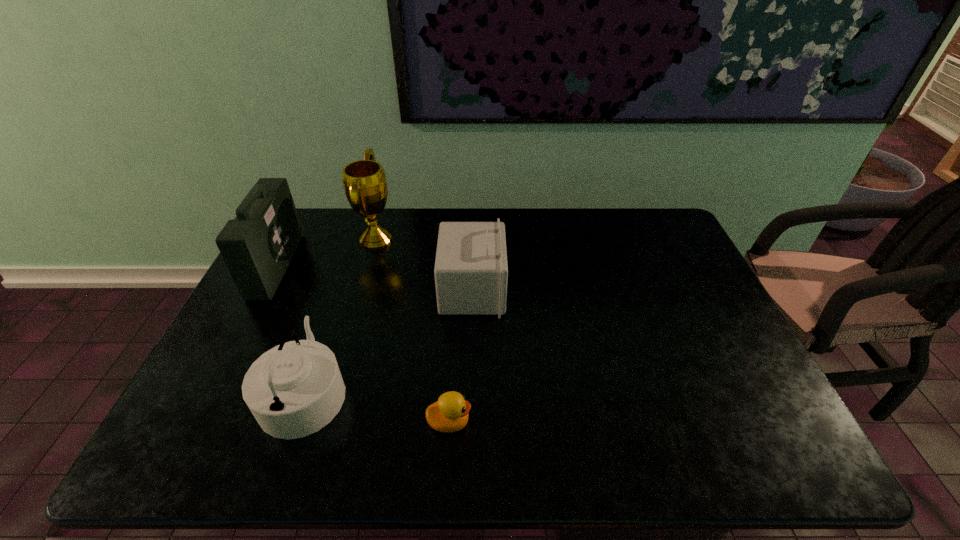
This screenshot has height=540, width=960. I want to click on award, so click(364, 181).

Locate an element on the screen. The width and height of the screenshot is (960, 540). the left first-aid kit is located at coordinates (257, 246).

At what (x,y) coordinates should I click in order to perform the action: click on the taller first-aid kit. Please return your answer as a coordinate pair (x, y). The height and width of the screenshot is (540, 960). Looking at the image, I should click on (257, 246).

You are a GUI agent. You are given a task and a screenshot of the screen. Output one action in this format:
    pyautogui.click(x=<x>, y=<y>)
    Task: Click on the right first-aid kit
    The height and width of the screenshot is (540, 960).
    Given the screenshot: What is the action you would take?
    pyautogui.click(x=471, y=271)

Locate an element on the screen. The height and width of the screenshot is (540, 960). the fourth tallest object is located at coordinates (293, 390).

Identify the location of duckling. This screenshot has height=540, width=960. (449, 414).

The image size is (960, 540). Identify the location of vacant region located on the front-facing side of the award. (483, 240).

Where is `free spot located 0.250m on the front-facing side of the left first-aid kit`? Image resolution: width=960 pixels, height=540 pixels. free spot located 0.250m on the front-facing side of the left first-aid kit is located at coordinates (367, 265).

Image resolution: width=960 pixels, height=540 pixels. Identify the location of vacant space located on the front-facing side of the shorter first-aid kit. (551, 291).

Where is `vacant space located on the spout of the kettle`? The image size is (960, 540). vacant space located on the spout of the kettle is located at coordinates (376, 391).